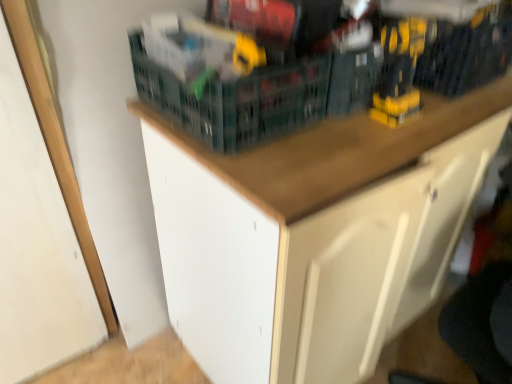
Question: From a real-world perspective, is yellow plastic drill at upper right, positioned as the second toy in left-to-right order, above or below yellow plastic drill at upper center, placed as the first toy when sorted from left to right?

Choices:
 (A) below
 (B) above

Answer: (A)

Question: Would you say yellow plastic drill at upper right, positioned as the second toy in left-to-right order, is to the left or to the right of yellow plastic drill at upper center, placed as the first toy when sorted from left to right, in the picture?

Choices:
 (A) left
 (B) right

Answer: (B)

Question: Which of these objects is positioned closest to the wooden cabinet at upper center?

Choices:
 (A) white matte drawer at lower right
 (B) green plastic basket at upper center
 (C) yellow plastic drill at upper center, the second toy positioned from the right
 (D) yellow plastic drill at upper right, positioned as the second toy in left-to-right order

Answer: (A)

Question: Based on their relative distances, which object is farther from the green plastic basket at upper center?

Choices:
 (A) wooden cabinet at upper center
 (B) yellow plastic drill at upper center, placed as the first toy when sorted from left to right
 (C) white matte drawer at lower right
 (D) yellow plastic drill at upper right, positioned as the second toy in left-to-right order

Answer: (C)